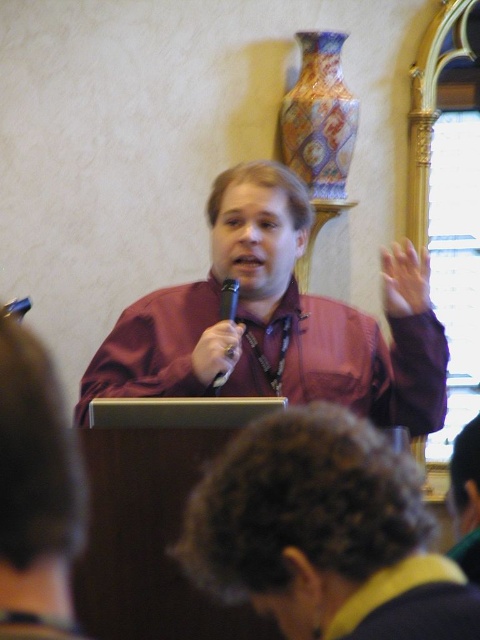
You are a photographer adjusting your camera settings to capture the speaker at the podium. You notice a point marked at coordinates (405, 280). What object is located at this point?

The point at coordinates (405, 280) marks the matte skin hand at upper right.

You are a photographer setting up for a live event. You need to ensure that the satin burgundy shirt at center and the multicolored ceramic vase at upper right are both visible in your shot. Given their sizes, which object would require you to adjust your camera angle more to include it in the frame?

The satin burgundy shirt at center has a greater width than the multicolored ceramic vase at upper right, so you would need to adjust your camera angle more to include the satin burgundy shirt at center in the frame.

You are a photographer adjusting your camera settings. You notice the matte skin hand at upper right in the frame. To ensure it is in focus, where should you adjust the focus point on your camera? Please provide coordinates as a pair of numbers between 0 and 1, with 0,0 being the bottom left corner and 1,1 the top right corner.

The matte skin hand at upper right is positioned at coordinates (405, 280). Adjust the focus point to this location to ensure it is in focus.